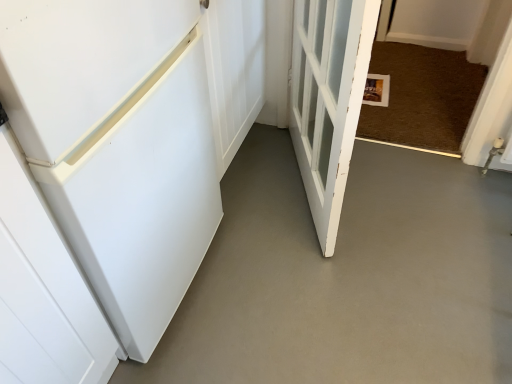
Question: Is white matte refrigerator at left, which ranks as the first door in left-to-right order, spatially inside white wooden door at center, which appears as the first door when viewed from the right, or outside of it?

Choices:
 (A) inside
 (B) outside

Answer: (B)

Question: In terms of height, does white matte refrigerator at left, the 2th door viewed from the right, look taller or shorter compared to white wooden door at center, the second door from the left?

Choices:
 (A) short
 (B) tall

Answer: (A)

Question: Which object is positioned closest to the white wooden door at center, the second door from the left?

Choices:
 (A) white matte refrigerator at left, which ranks as the first door in left-to-right order
 (B) white smooth concrete at lower left

Answer: (B)

Question: Considering the real-world distances, which object is closest to the white wooden door at center, the second door from the left?

Choices:
 (A) white smooth concrete at lower left
 (B) white matte refrigerator at left, which ranks as the first door in left-to-right order

Answer: (A)